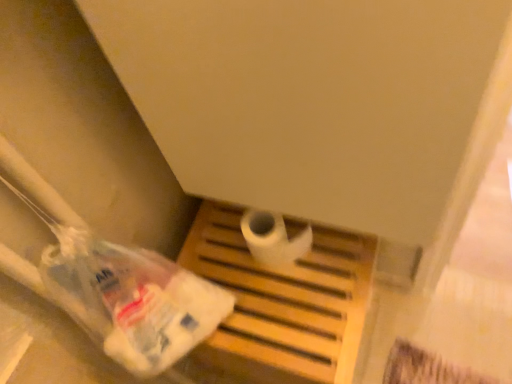
Question: Is translucent plastic bag at lower left to the right of white matte toilet paper at center from the viewer's perspective?

Choices:
 (A) yes
 (B) no

Answer: (B)

Question: Is translucent plastic bag at lower left further to camera compared to white matte toilet paper at center?

Choices:
 (A) no
 (B) yes

Answer: (A)

Question: Is translucent plastic bag at lower left in front of white matte toilet paper at center?

Choices:
 (A) yes
 (B) no

Answer: (A)

Question: Can you confirm if translucent plastic bag at lower left is wider than white matte toilet paper at center?

Choices:
 (A) yes
 (B) no

Answer: (A)

Question: Is translucent plastic bag at lower left not inside white matte toilet paper at center?

Choices:
 (A) no
 (B) yes

Answer: (B)

Question: Is translucent plastic bag at lower left positioned with its back to white matte toilet paper at center?

Choices:
 (A) no
 (B) yes

Answer: (B)

Question: From a real-world perspective, is wooden tray at center on top of white matte toilet paper at center?

Choices:
 (A) yes
 (B) no

Answer: (B)

Question: Can you confirm if wooden tray at center is smaller than white matte toilet paper at center?

Choices:
 (A) no
 (B) yes

Answer: (A)

Question: Is wooden tray at center bigger than white matte toilet paper at center?

Choices:
 (A) no
 (B) yes

Answer: (B)

Question: Is white matte toilet paper at center completely or partially inside wooden tray at center?

Choices:
 (A) no
 (B) yes

Answer: (A)

Question: Could you tell me if wooden tray at center is turned towards white matte toilet paper at center?

Choices:
 (A) no
 (B) yes

Answer: (A)

Question: Is wooden tray at center positioned in front of white matte toilet paper at center?

Choices:
 (A) yes
 (B) no

Answer: (B)

Question: From the image's perspective, would you say white matte toilet paper at center is positioned over translucent plastic bag at lower left?

Choices:
 (A) yes
 (B) no

Answer: (A)